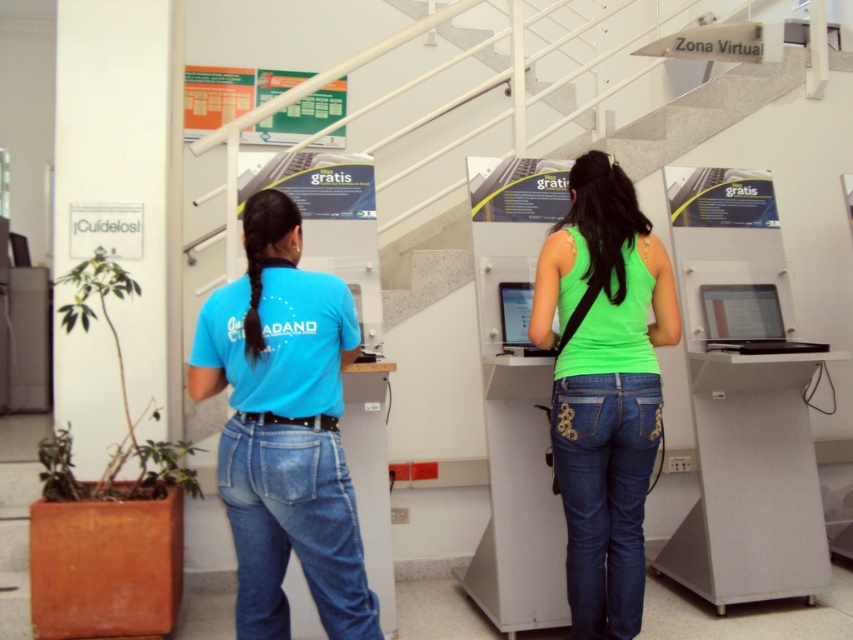
Question: Estimate the real-world distances between objects in this image. Which object is farther from the matte black monitor at center?

Choices:
 (A) matte black register at center
 (B) blue denim jeans at center
 (C) neon green tank top at center
 (D) matte blue shirt at center

Answer: (B)

Question: Does matte blue shirt at center have a smaller size compared to blue denim jeans at center?

Choices:
 (A) no
 (B) yes

Answer: (A)

Question: Estimate the real-world distances between objects in this image. Which object is farther from the matte blue shirt at center?

Choices:
 (A) matte black monitor at center
 (B) dark blue denim jeans at center
 (C) neon green tank top at center

Answer: (A)

Question: Which object appears farthest from the camera in this image?

Choices:
 (A) dark blue denim jeans at center
 (B) blue denim jeans at center
 (C) matte black monitor at center

Answer: (C)

Question: In this image, where is matte blue shirt at center located relative to neon green tank top at center?

Choices:
 (A) right
 (B) left

Answer: (B)

Question: Does dark blue denim jeans at center have a greater width compared to matte black register at center?

Choices:
 (A) no
 (B) yes

Answer: (A)